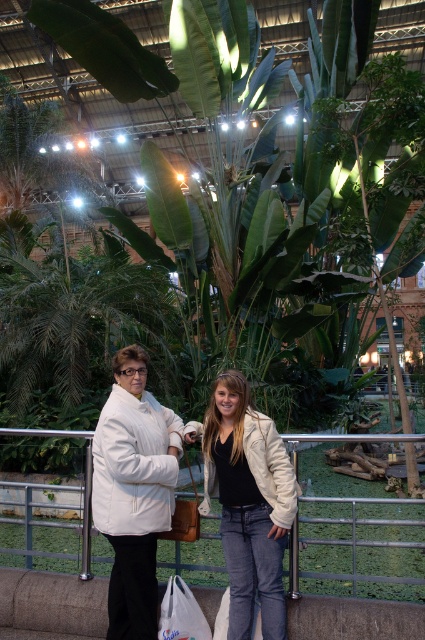
Is point (249, 554) more distant than point (297, 576)?

No.

Between denim jacket at center and metal/rustic fence at lower center, which one appears on the right side from the viewer's perspective?

denim jacket at center is more to the right.

Locate an element on the screen. This screenshot has height=640, width=425. denim jacket at center is located at coordinates (248, 500).

Can you confirm if metal/rustic fence at lower center is taller than white fabric bag at lower center?

Correct, metal/rustic fence at lower center is much taller as white fabric bag at lower center.

From the picture: Can you confirm if metal/rustic fence at lower center is thinner than white fabric bag at lower center?

Incorrect, metal/rustic fence at lower center's width is not less than white fabric bag at lower center's.

Does point (292, 442) come in front of point (186, 600)?

No, (292, 442) is behind (186, 600).

Identify the location of metal/rustic fence at lower center. (345, 438).

Is point (271, 460) positioned behind point (206, 637)?

No, (271, 460) is closer to viewer.

Between denim jacket at center and white fabric bag at lower center, which one is positioned lower?

white fabric bag at lower center is below.

Does point (238, 429) come behind point (163, 605)?

That is False.

You are a GUI agent. You are given a task and a screenshot of the screen. Output one action in this format:
    pyautogui.click(x=<x>, y=<y>)
    Task: Click on the denim jacket at center
    This screenshot has width=425, height=640.
    Given the screenshot: What is the action you would take?
    pyautogui.click(x=248, y=500)